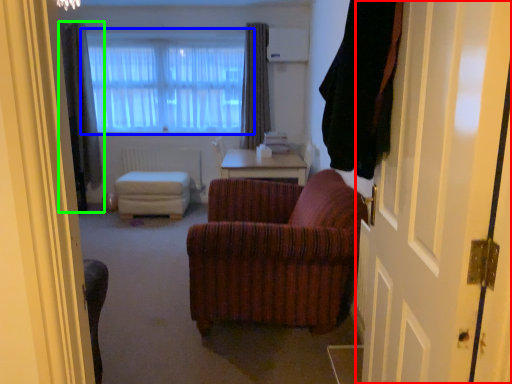
Question: Which is nearer to the door (highlighted by a red box)? window (highlighted by a blue box) or curtain (highlighted by a green box).

Choices:
 (A) window
 (B) curtain

Answer: (A)